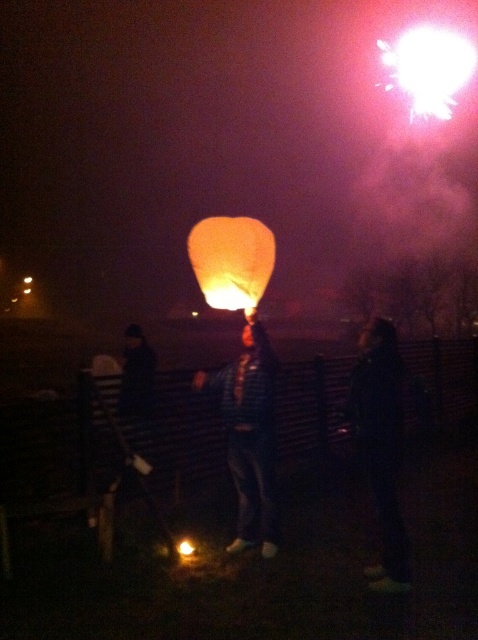
Who is shorter, striped fabric pants at center or matte orange paper lantern at center?

striped fabric pants at center is shorter.

Where is `striped fabric pants at center`? This screenshot has width=478, height=640. striped fabric pants at center is located at coordinates (249, 435).

Between striped fabric pants at center and dark blue fabric pants at right, which one is positioned lower?

dark blue fabric pants at right

Is striped fabric pants at center bigger than dark blue fabric pants at right?

Correct, striped fabric pants at center is larger in size than dark blue fabric pants at right.

The width and height of the screenshot is (478, 640). I want to click on striped fabric pants at center, so click(249, 435).

Does dark blue fabric pants at right appear over bright white light at upper right?

Incorrect, dark blue fabric pants at right is not positioned above bright white light at upper right.

Is dark blue fabric pants at right wider than bright white light at upper right?

In fact, dark blue fabric pants at right might be narrower than bright white light at upper right.

The width and height of the screenshot is (478, 640). Describe the element at coordinates (380, 444) in the screenshot. I see `dark blue fabric pants at right` at that location.

Locate an element on the screen. Image resolution: width=478 pixels, height=640 pixels. dark blue fabric pants at right is located at coordinates (380, 444).